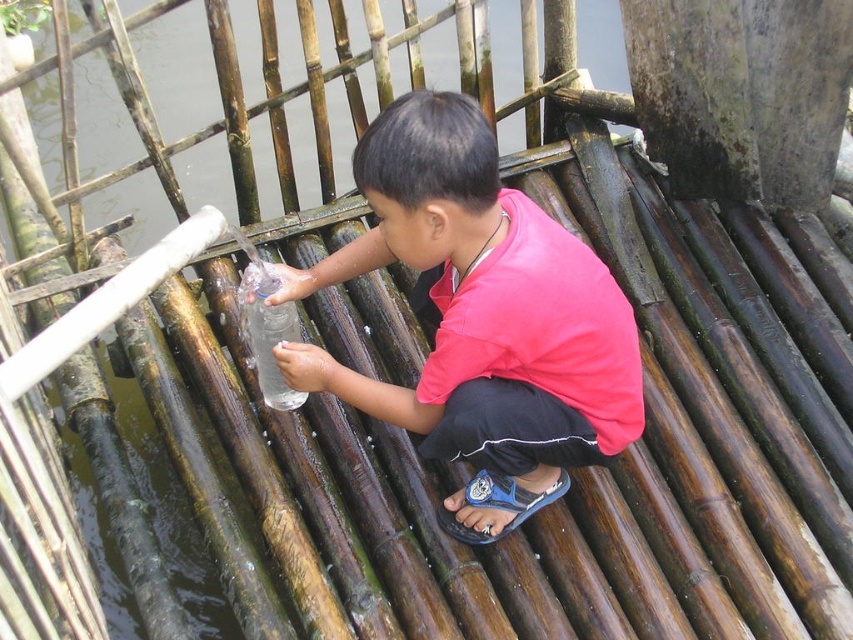
You are a photographer aiming to capture the reflection of the transparent plastic water at center and the matte plastic bottle at center in the water body shown in the scene. Which object will have its reflection closer to the photographer?

The transparent plastic water at center is further to the viewer than the matte plastic bottle at center, so its reflection will be closer to the photographer.